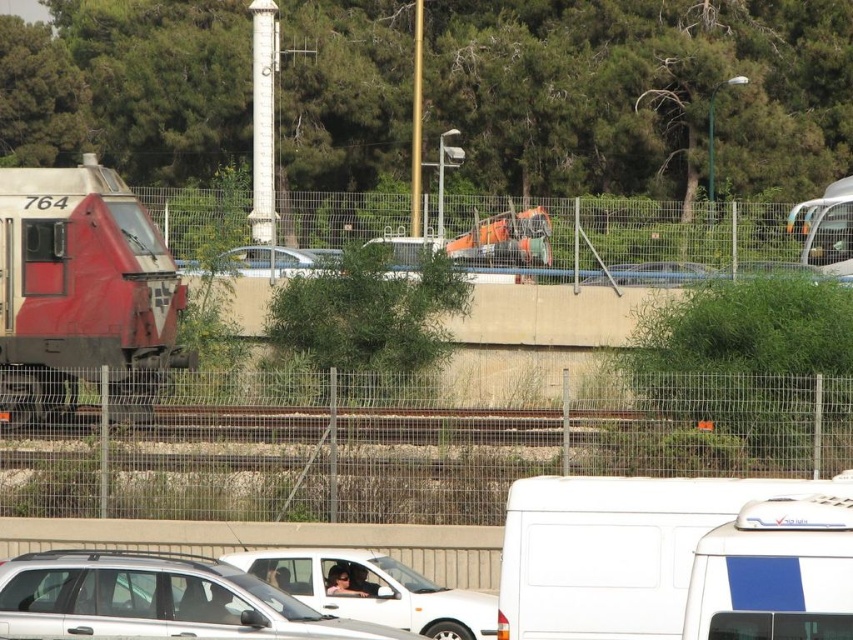
Does silver metallic suv at center have a lesser height compared to white matte car at center?

Correct, silver metallic suv at center is not as tall as white matte car at center.

Does point (94, 582) come closer to viewer compared to point (352, 593)?

Yes, point (94, 582) is closer to viewer.

Which is behind, point (36, 612) or point (376, 616)?

The point (376, 616) is behind.

This screenshot has width=853, height=640. I want to click on silver metallic suv at center, so click(157, 600).

Measure the distance between point (x=532, y=538) and camera.

The distance of point (x=532, y=538) from camera is 48.62 feet.

Identify the location of white matte van at lower right. (614, 548).

Which of these two, matte red train at left or white matte van at lower right, stands taller?

With more height is matte red train at left.

This screenshot has height=640, width=853. What are the coordinates of `matte red train at left` in the screenshot? It's located at (82, 294).

Who is more distant from viewer, (32, 355) or (672, 516)?

Positioned behind is point (32, 355).

Where is `matte red train at left`? matte red train at left is located at coordinates (x=82, y=294).